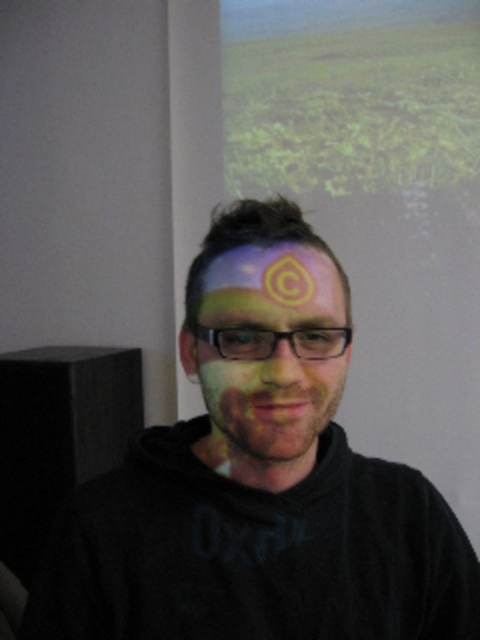
Does matte painted face at center have a greater height compared to painted face at center?

Yes.

Between matte painted face at center and painted face at center, which one is positioned higher?

painted face at center

Identify the location of matte painted face at center. This screenshot has width=480, height=640. (257, 480).